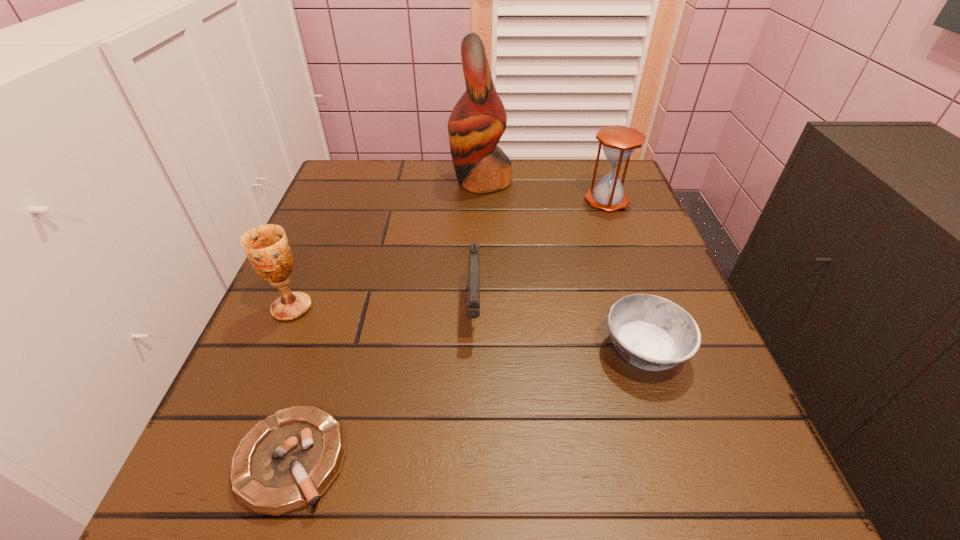
Identify the location of blank region between the hourglass and the chalice. (449, 254).

Choose which object is the third nearest neighbor to the parrot. Please provide its 2D coordinates. Your answer should be formatted as a tuple, i.e. [(x, y)], where the tuple contains the x and y coordinates of a point satisfying the conditions above.

[(266, 246)]

Locate which object is the third closest to the parrot. Please provide its 2D coordinates. Your answer should be formatted as a tuple, i.e. [(x, y)], where the tuple contains the x and y coordinates of a point satisfying the conditions above.

[(266, 246)]

This screenshot has height=540, width=960. What are the coordinates of `vacant space that satisfies the following two spatial constraints: 1. at the barrel of the farther ashtray; 2. on the right side of the fourth tallest object` in the screenshot? It's located at (474, 350).

Locate an element on the screen. free spot that satisfies the following two spatial constraints: 1. on the face of the parrot; 2. on the left side of the farther ashtray is located at coordinates (482, 350).

I want to click on free space that satisfies the following two spatial constraints: 1. on the face of the parrot; 2. at the barrel of the pistol, so click(x=482, y=310).

The height and width of the screenshot is (540, 960). Identify the location of free space that satisfies the following two spatial constraints: 1. on the face of the parrot; 2. on the right side of the right ashtray. (482, 350).

The height and width of the screenshot is (540, 960). I want to click on vacant region that satisfies the following two spatial constraints: 1. on the face of the tallest object; 2. on the left side of the hourglass, so click(x=482, y=200).